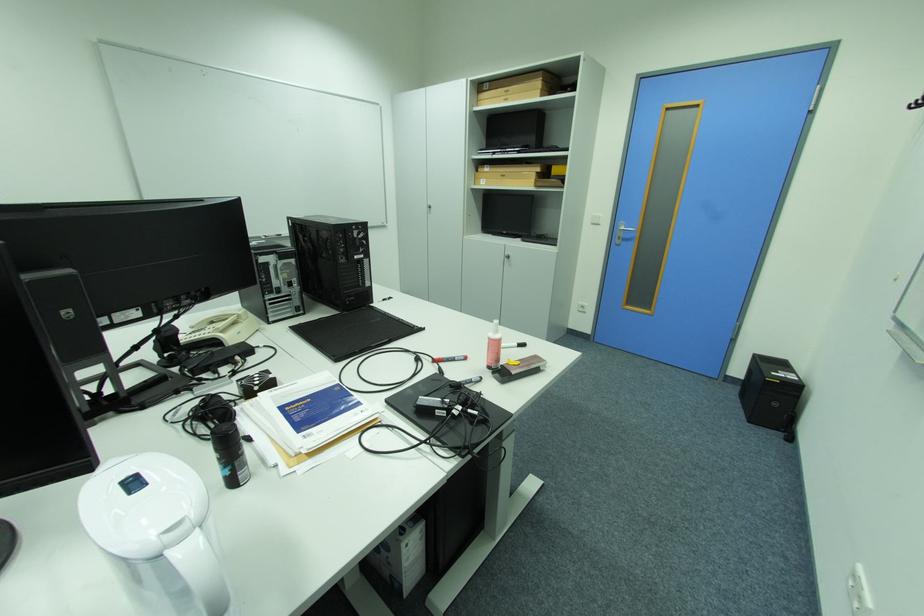
Which object does [448,359] point to?

It corresponds to the black marker in the image.